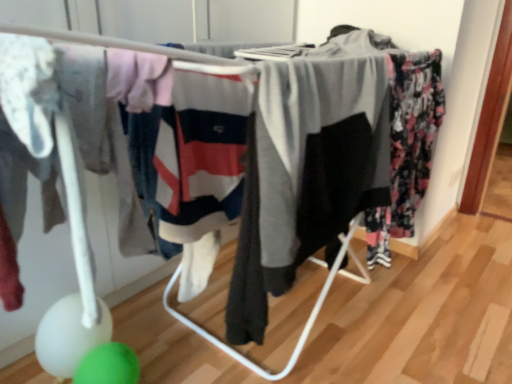
This screenshot has height=384, width=512. Describe the element at coordinates (71, 333) in the screenshot. I see `white glossy balloon at lower left` at that location.

You are a GUI agent. You are given a task and a screenshot of the screen. Output one action in this format:
    pyautogui.click(x=<x>, y=<y>)
    Task: Click on the white glossy balloon at lower left
    The width and height of the screenshot is (512, 384).
    Given the screenshot: What is the action you would take?
    pyautogui.click(x=71, y=333)

Find the location of a particular element. The image size is (512, 384). white glossy balloon at lower left is located at coordinates (71, 333).